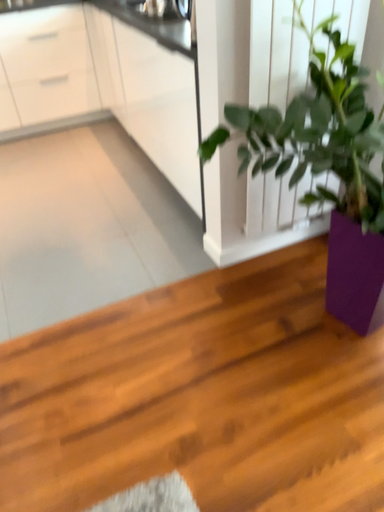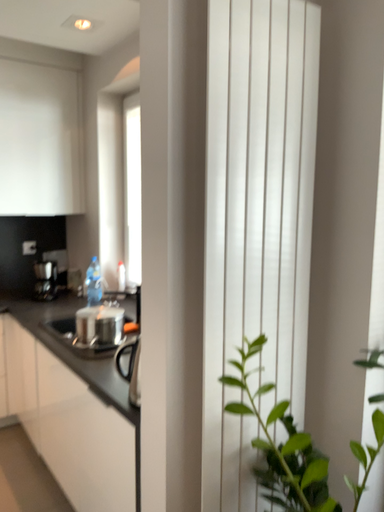
Question: How did the camera likely rotate when shooting the video?

Choices:
 (A) rotated left
 (B) rotated right

Answer: (B)